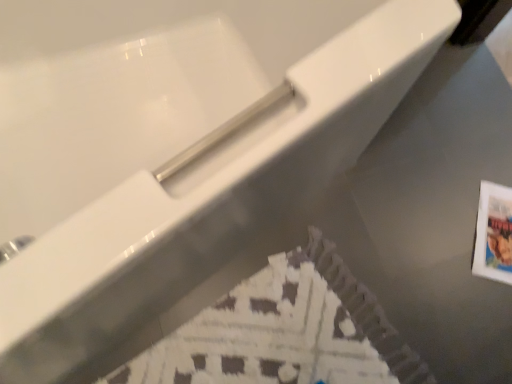
Where is `free point in front of printed paper postcard at lower right`? This screenshot has height=384, width=512. free point in front of printed paper postcard at lower right is located at coordinates (477, 316).